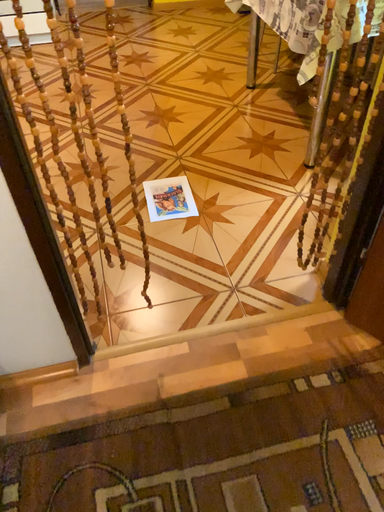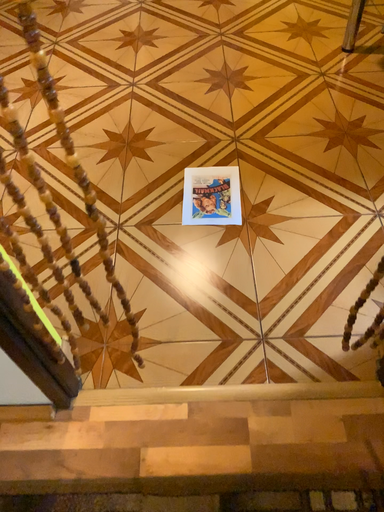
Question: How did the camera likely rotate when shooting the video?

Choices:
 (A) rotated downward
 (B) rotated upward

Answer: (A)